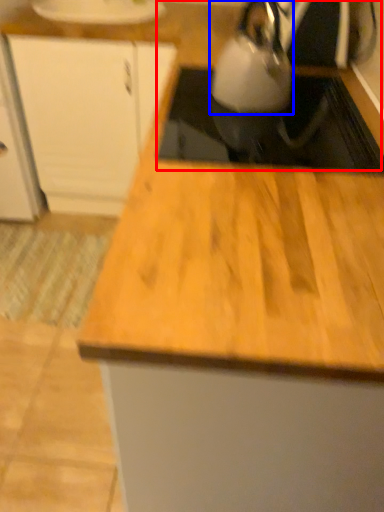
Question: Which object is further to the camera taking this photo, sink (highlighted by a red box) or kettle (highlighted by a blue box)?

Choices:
 (A) sink
 (B) kettle

Answer: (B)